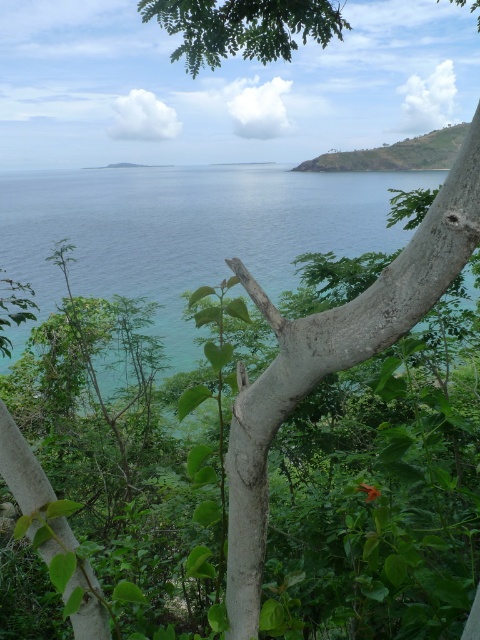
Consider the image. Which of these two, green water at center or green rough bark tree at center, stands taller?

With more height is green water at center.

Does point (156, 294) come closer to viewer compared to point (256, 38)?

No, it is not.

This screenshot has height=640, width=480. In order to click on green water at center in this screenshot , I will do `click(189, 230)`.

Is the position of green rough bark tree at center less distant than that of green grassy hill at upper right?

Yes, it is.

Locate an element on the screen. green rough bark tree at center is located at coordinates (x=334, y=362).

Locate an element on the screen. This screenshot has height=640, width=480. green rough bark tree at center is located at coordinates (334, 362).

Who is taller, green water at center or green grassy hill at upper right?

green water at center

Is point (250, 204) behind point (425, 168)?

No, it is not.

Is point (165, 176) closer to viewer compared to point (405, 157)?

Yes, point (165, 176) is in front of point (405, 157).

Where is `green water at center`? green water at center is located at coordinates (189, 230).